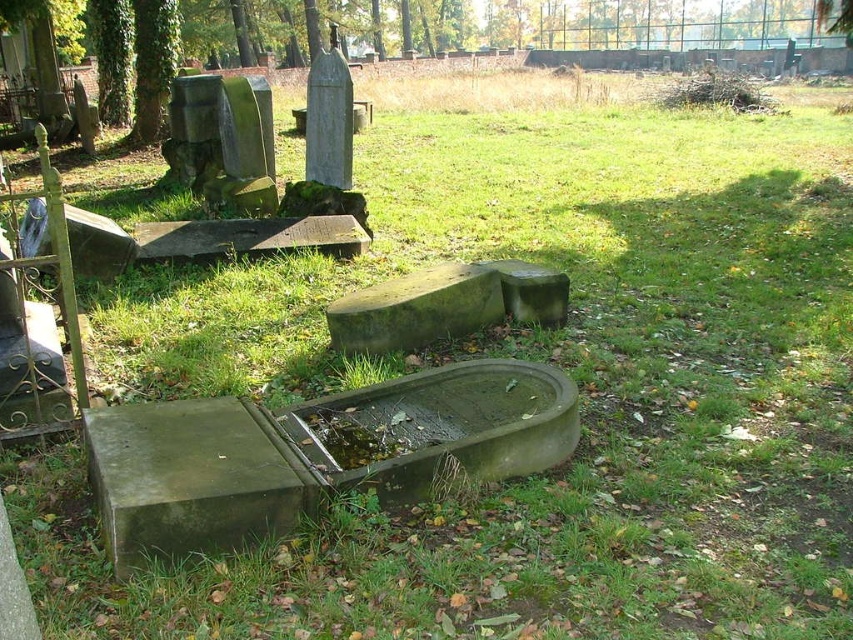
Question: Is green stone gravestone at lower left below green mossy stone at center?

Choices:
 (A) no
 (B) yes

Answer: (B)

Question: Can you confirm if green stone gravestone at lower left is wider than green stone gravestone at center?

Choices:
 (A) yes
 (B) no

Answer: (A)

Question: Which of the following is the closest to the observer?

Choices:
 (A) green mossy stone at center
 (B) green stone gravestone at lower left
 (C) green stone gravestone at center

Answer: (B)

Question: Is green mossy stone at center below green stone gravestone at center?

Choices:
 (A) yes
 (B) no

Answer: (A)

Question: Based on their relative distances, which object is nearer to the green stone gravestone at lower left?

Choices:
 (A) green mossy stone at center
 (B) green stone gravestone at center

Answer: (A)

Question: Considering the real-world distances, which object is farthest from the green mossy stone at center?

Choices:
 (A) green stone gravestone at center
 (B) green stone gravestone at lower left

Answer: (B)